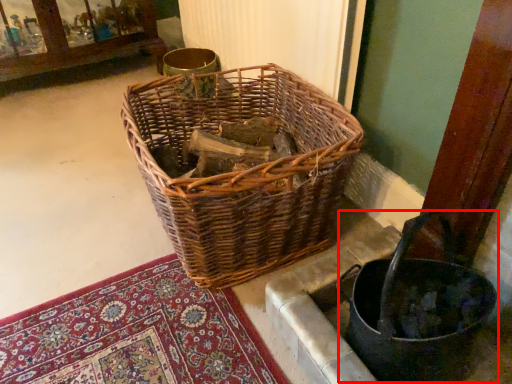
Question: From the image, what is the correct spatial relationship of basket container (annotated by the red box) in relation to picnic basket?

Choices:
 (A) left
 (B) right

Answer: (B)